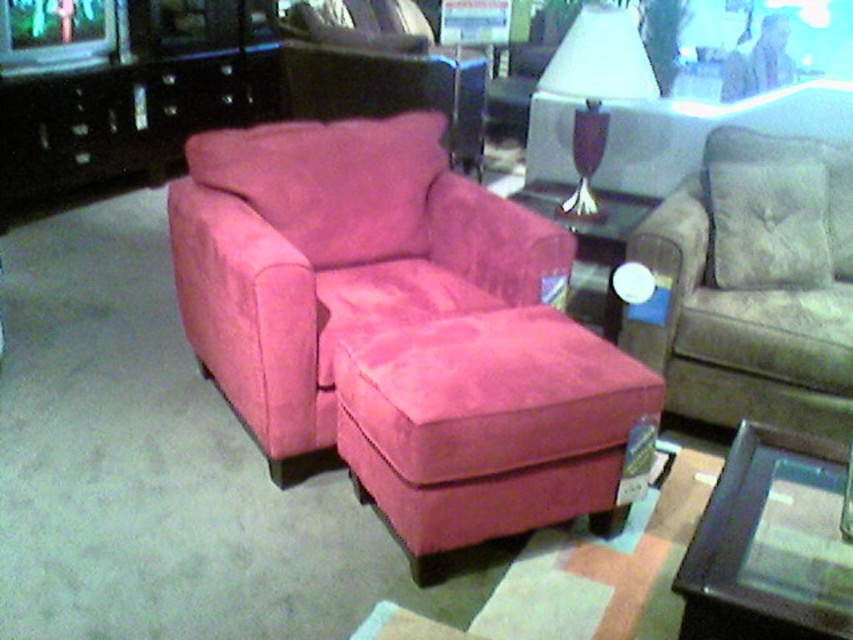
Which is above, suede pink ottoman at center or suede-like beige pillow at upper right?

Positioned higher is suede-like beige pillow at upper right.

Is suede pink ottoman at center to the left of suede-like beige pillow at upper right from the viewer's perspective?

Indeed, suede pink ottoman at center is positioned on the left side of suede-like beige pillow at upper right.

Is point (466, 538) positioned before point (755, 204)?

Yes, point (466, 538) is in front of point (755, 204).

Find the location of a particular element. This screenshot has height=640, width=853. suede pink ottoman at center is located at coordinates (489, 426).

Is suede pink armchair at center taller than suede-like beige pillow at upper right?

Yes, suede pink armchair at center is taller than suede-like beige pillow at upper right.

Between point (454, 248) and point (787, 204), which one is positioned in front?

Point (787, 204) is more forward.

Between point (364, 259) and point (750, 216), which one is positioned in front?

Point (750, 216)

Find the location of a particular element. The image size is (853, 640). suede pink armchair at center is located at coordinates (334, 256).

Is suede-like beige pillow at upper right taller than matte white lamp at upper center?

Incorrect, suede-like beige pillow at upper right's height is not larger of matte white lamp at upper center's.

Which of these two, suede-like beige pillow at upper right or matte white lamp at upper center, stands taller?

matte white lamp at upper center is taller.

Is point (776, 176) farther from viewer compared to point (646, 88)?

That is False.

I want to click on suede-like beige pillow at upper right, so click(x=769, y=225).